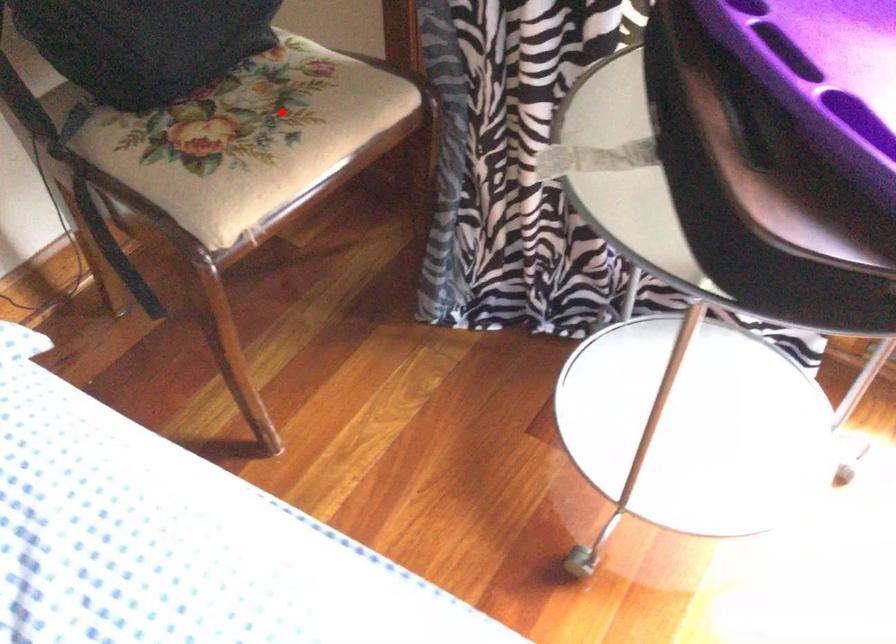
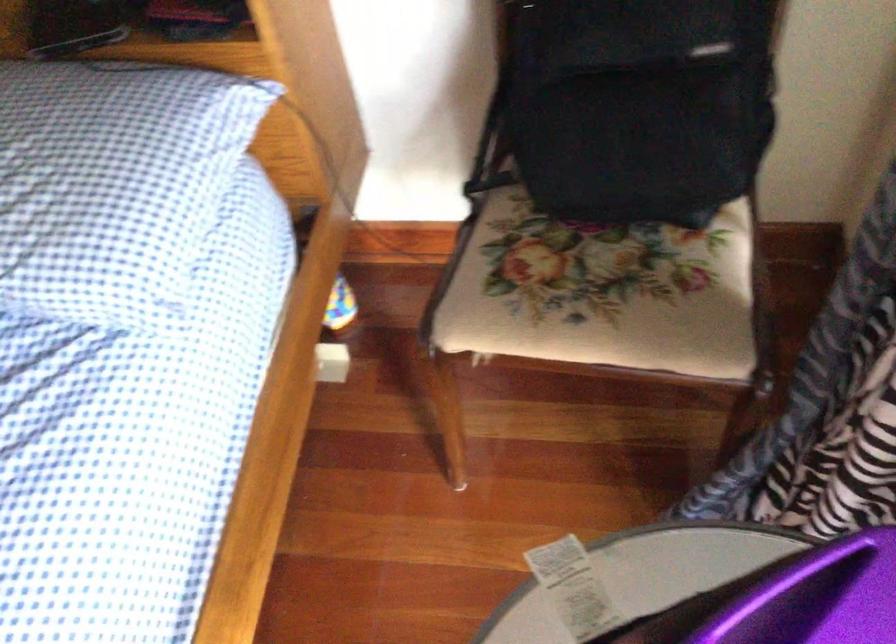
Locate, in the second image, the point that corresponds to the highlighted location in the first image.

(599, 292)